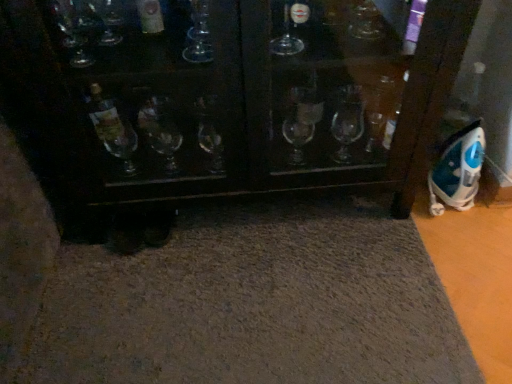
You are a GUI agent. You are given a task and a screenshot of the screen. Output one action in this format:
    pyautogui.click(x=<x>, y=<y>)
    Task: Click on the vacant space in between blue plastic iron at right and gray carpet at lower center
    Image resolution: width=512 pixels, height=384 pixels.
    Given the screenshot: What is the action you would take?
    pyautogui.click(x=456, y=268)